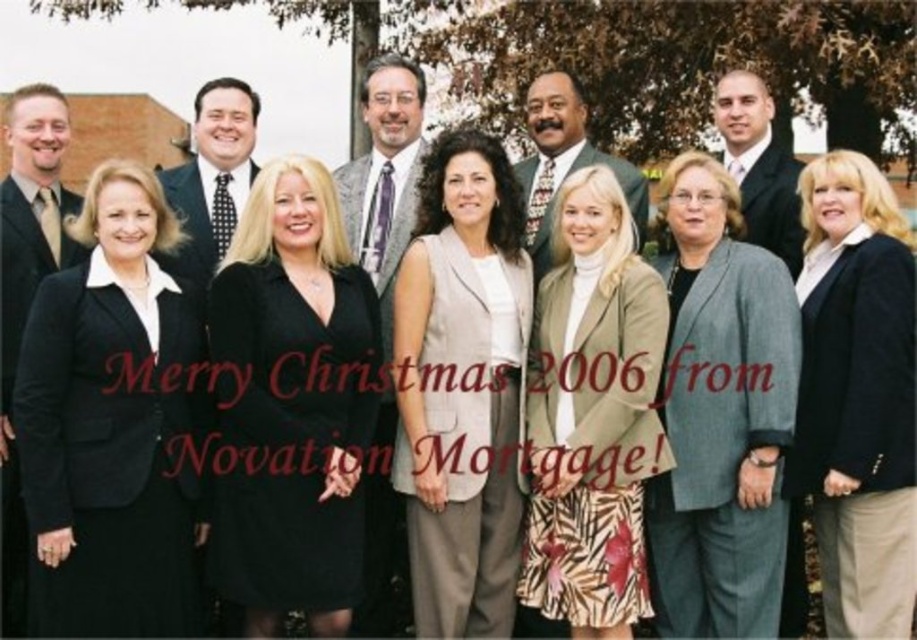
Question: Which is farther from the beige textured blazer at center?

Choices:
 (A) black matte dress at center
 (B) matte black suit at right

Answer: (A)

Question: Can you confirm if matte gray suit at center is positioned to the left of matte black suit at left?

Choices:
 (A) yes
 (B) no

Answer: (B)

Question: Is the position of beige textured vest at center less distant than that of beige textured blazer at center?

Choices:
 (A) yes
 (B) no

Answer: (B)

Question: Which of these objects is positioned farthest from the beige textured vest at center?

Choices:
 (A) polka dot tie at center
 (B) matte black suit at left
 (C) black matte dress at center
 (D) matte gray suit at center

Answer: (B)

Question: Can you confirm if matte gray suit at center is wider than matte black suit at left?

Choices:
 (A) yes
 (B) no

Answer: (B)

Question: Which point is closer to the camera?

Choices:
 (A) pos(244,144)
 (B) pos(279,292)
 (C) pos(577,164)

Answer: (B)